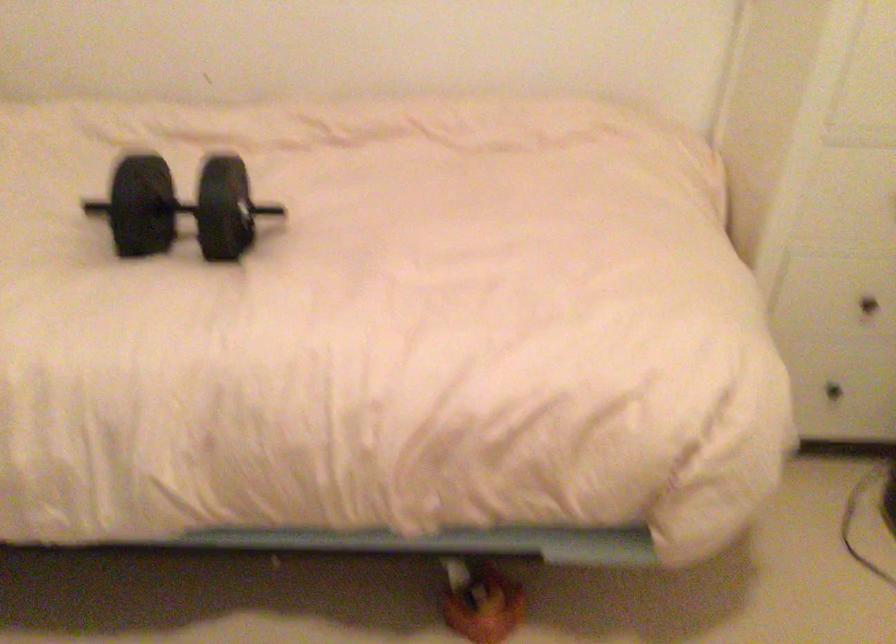
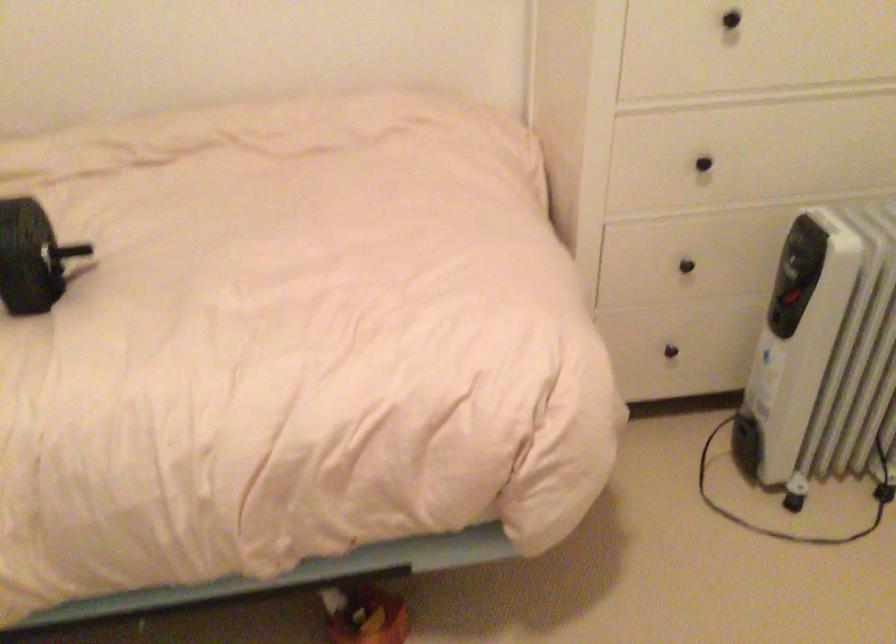
Find the pixel in the second image that matches point 230,212 in the first image.

(30, 257)